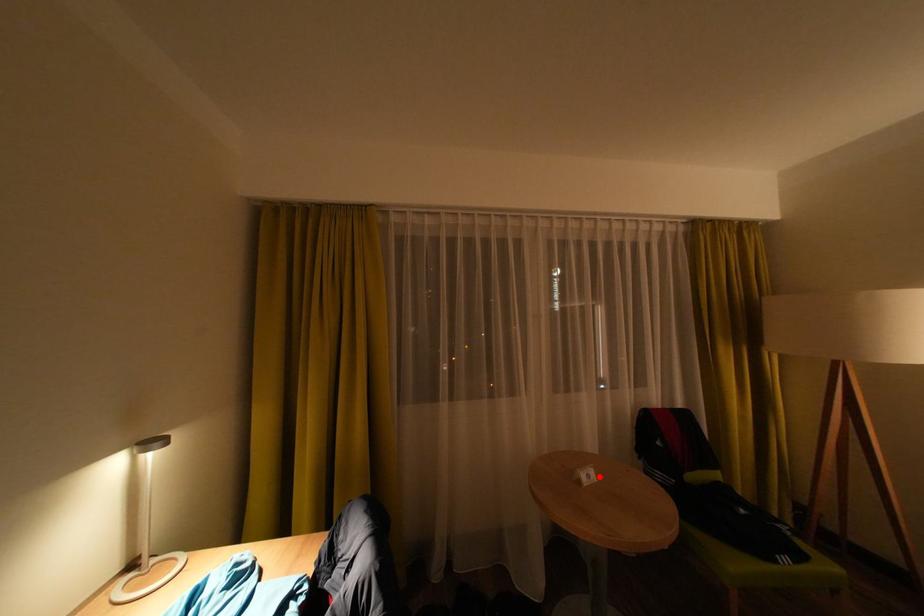
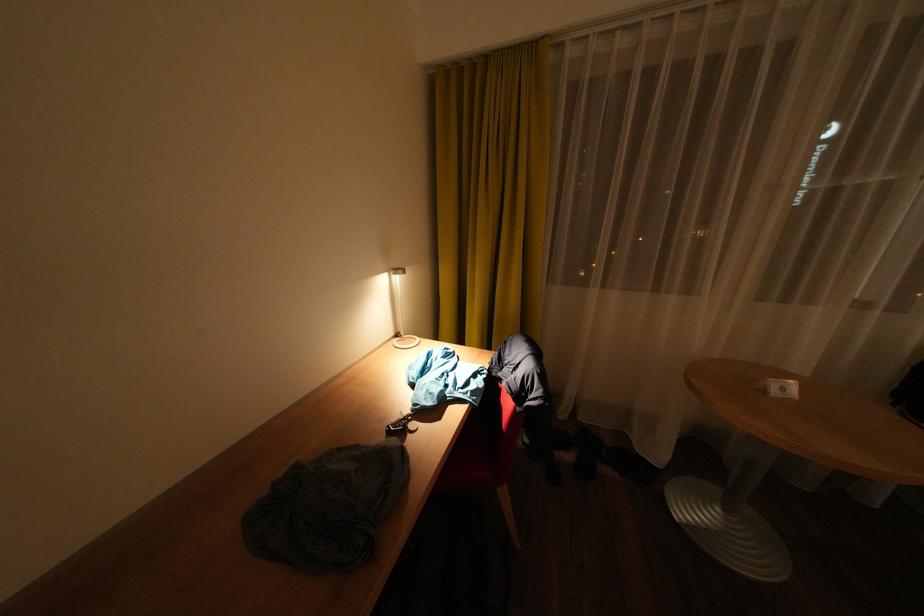
In the second image, find the point that corresponds to the highlighted location in the first image.

(794, 390)